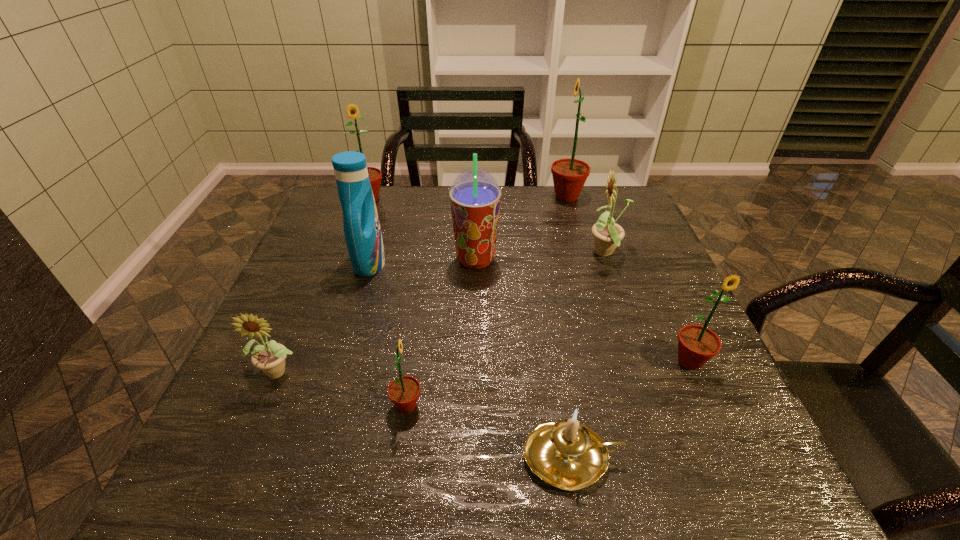
The width and height of the screenshot is (960, 540). I want to click on the nearer yellow sunflower, so click(x=270, y=358).

Find the location of a particular element. The image size is (960, 540). the left yellow sunflower is located at coordinates (270, 358).

Find the location of a particular element. the fourth sunflower from right to left is located at coordinates (403, 391).

You are a GUI agent. You are given a task and a screenshot of the screen. Output one action in this format:
    pyautogui.click(x=<x>, y=<y>)
    Task: Click on the second nearest object
    
    Given the screenshot: What is the action you would take?
    pyautogui.click(x=403, y=391)

This screenshot has width=960, height=540. I want to click on the nearest object, so click(x=568, y=455).

Where is `candle holder`? The image size is (960, 540). candle holder is located at coordinates (x=568, y=455).

You are a GUI agent. You are given a task and a screenshot of the screen. Output one action in this format:
    pyautogui.click(x=<x>, y=<y>)
    Task: Click on the vacant space located on the face of the tallest object
    This screenshot has width=960, height=540.
    Given the screenshot: What is the action you would take?
    pyautogui.click(x=519, y=197)

Where is `free space located 0.160m on the face of the tallest object`? Image resolution: width=960 pixels, height=540 pixels. free space located 0.160m on the face of the tallest object is located at coordinates (497, 197).

Identify the location of free point located on the face of the tallest object. (488, 197).

At what (x,y) coordinates should I click in order to perform the action: click on vacant space positioned on the face of the leftmost green sunflower. Please return your answer as a coordinate pair (x, y). Image resolution: width=960 pixels, height=540 pixels. Looking at the image, I should click on (363, 216).